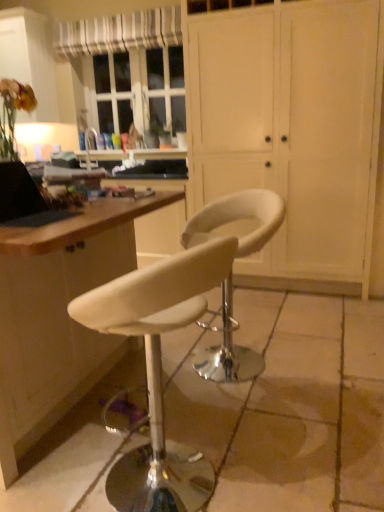
Locate an element on the screen. empty space that is to the right of white leather stool at center, which appears as the first chair when viewed from the back is located at coordinates (321, 359).